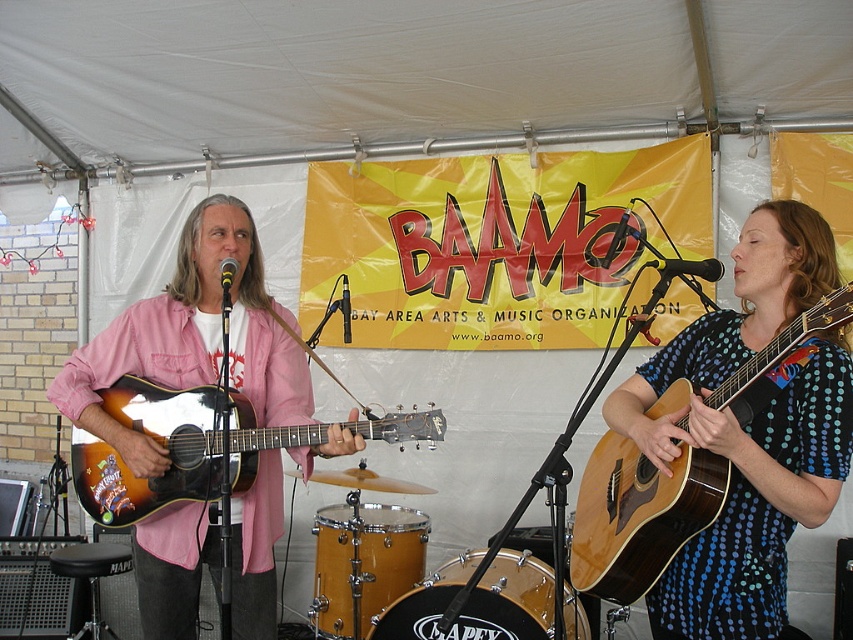
Question: Which of the following is the closest to the observer?

Choices:
 (A) [474, 564]
 (B) [846, 300]
 (C) [332, 616]
 (D) [172, 449]

Answer: (B)

Question: Is natural wood acoustic guitar at right to the left of yellow wood drum at lower center from the viewer's perspective?

Choices:
 (A) no
 (B) yes

Answer: (A)

Question: Which point is farther to the camera?

Choices:
 (A) (428, 620)
 (B) (364, 561)

Answer: (B)

Question: Which object is positioned farthest from the black drumhead at center?

Choices:
 (A) natural wood acoustic guitar at right
 (B) yellow wood drum at lower center
 (C) sunburst wood acoustic guitar at left

Answer: (C)

Question: Does natural wood acoustic guitar at right appear on the left side of yellow wood drum at lower center?

Choices:
 (A) yes
 (B) no

Answer: (B)

Question: Can you confirm if sunburst wood acoustic guitar at left is thinner than black drumhead at center?

Choices:
 (A) no
 (B) yes

Answer: (A)